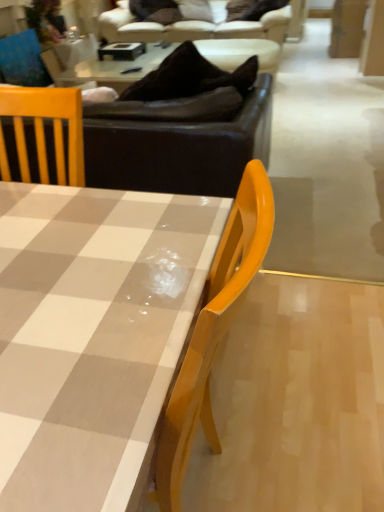
Question: From a real-world perspective, is matte brown plywood at upper right under matte blue cushion at upper left?

Choices:
 (A) yes
 (B) no

Answer: (A)

Question: Is matte brown plywood at upper right behind matte blue cushion at upper left?

Choices:
 (A) no
 (B) yes

Answer: (B)

Question: Can you confirm if matte brown plywood at upper right is wider than matte blue cushion at upper left?

Choices:
 (A) no
 (B) yes

Answer: (B)

Question: From the image's perspective, is matte brown plywood at upper right located above matte blue cushion at upper left?

Choices:
 (A) no
 (B) yes

Answer: (B)

Question: From a real-world perspective, is matte brown plywood at upper right on matte blue cushion at upper left?

Choices:
 (A) yes
 (B) no

Answer: (B)

Question: From the image's perspective, is brown leather couch at upper center, marked as the second studio couch in a top-to-bottom arrangement, positioned above or below matte blue cushion at upper left?

Choices:
 (A) below
 (B) above

Answer: (A)

Question: Is brown leather couch at upper center, marked as the second studio couch in a top-to-bottom arrangement, bigger or smaller than matte blue cushion at upper left?

Choices:
 (A) small
 (B) big

Answer: (B)

Question: Considering their positions, is brown leather couch at upper center, the 1th studio couch from the front, located in front of or behind matte blue cushion at upper left?

Choices:
 (A) behind
 (B) front

Answer: (B)

Question: Choose the correct answer: Is brown leather couch at upper center, the 1th studio couch from the front, inside matte blue cushion at upper left or outside it?

Choices:
 (A) outside
 (B) inside

Answer: (A)

Question: Is point (150, 31) closer or farther from the camera than point (31, 331)?

Choices:
 (A) closer
 (B) farther

Answer: (B)

Question: In the image, is brown leather couch at upper center, which ranks as the 1th studio couch in back-to-front order, positioned in front of or behind checkered fabric coffee table at center?

Choices:
 (A) front
 (B) behind

Answer: (B)

Question: From the image's perspective, relative to checkered fabric coffee table at center, is brown leather couch at upper center, which is the 1th studio couch in top-to-bottom order, above or below?

Choices:
 (A) above
 (B) below

Answer: (A)

Question: Considering the positions of brown leather couch at upper center, the second studio couch viewed from the front, and checkered fabric coffee table at center in the image, is brown leather couch at upper center, the second studio couch viewed from the front, bigger or smaller than checkered fabric coffee table at center?

Choices:
 (A) big
 (B) small

Answer: (A)

Question: In terms of width, does checkered fabric coffee table at center look wider or thinner when compared to brown leather couch at upper center, marked as the second studio couch in a top-to-bottom arrangement?

Choices:
 (A) wide
 (B) thin

Answer: (B)

Question: Is checkered fabric coffee table at center spatially inside brown leather couch at upper center, marked as the second studio couch in a top-to-bottom arrangement, or outside of it?

Choices:
 (A) outside
 (B) inside

Answer: (A)